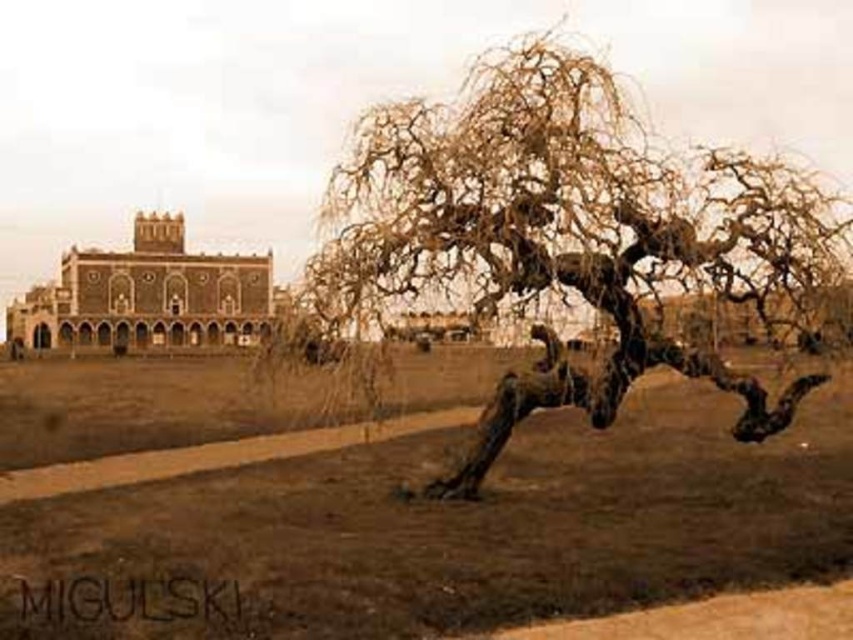
Question: Does brown dirt field at center appear under brown textured tree at center?

Choices:
 (A) yes
 (B) no

Answer: (A)

Question: Estimate the real-world distances between objects in this image. Which object is closer to the brown stone palace at upper left?

Choices:
 (A) brown dirt field at center
 (B) brown textured tree at center

Answer: (A)

Question: Estimate the real-world distances between objects in this image. Which object is closer to the brown stone palace at upper left?

Choices:
 (A) brown dirt field at center
 (B) brown textured tree at center

Answer: (A)

Question: Does brown dirt field at center appear under brown textured tree at center?

Choices:
 (A) no
 (B) yes

Answer: (B)

Question: Can you confirm if brown dirt field at center is smaller than brown stone palace at upper left?

Choices:
 (A) no
 (B) yes

Answer: (A)

Question: Which of the following is the closest to the observer?

Choices:
 (A) (511, 401)
 (B) (281, 289)
 (C) (558, 477)

Answer: (A)